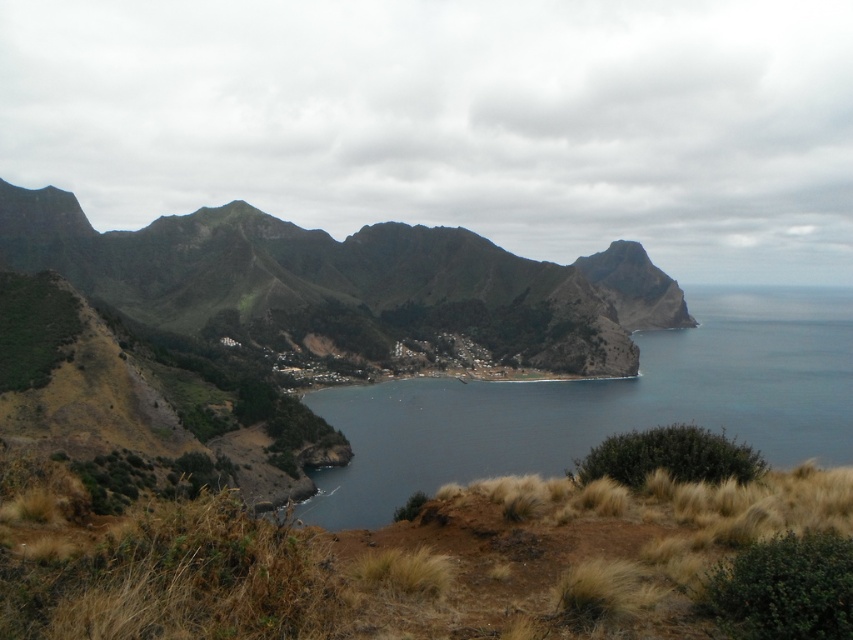
Question: Is green rough mountain at center behind dark blue water at center?

Choices:
 (A) no
 (B) yes

Answer: (B)

Question: Which of the following is the farthest from the observer?

Choices:
 (A) (537, 440)
 (B) (621, 337)

Answer: (B)

Question: Can you confirm if green rough mountain at center is thinner than dark blue water at center?

Choices:
 (A) no
 (B) yes

Answer: (A)

Question: Is green rough mountain at center in front of dark blue water at center?

Choices:
 (A) yes
 (B) no

Answer: (B)

Question: Among these points, which one is nearest to the camera?

Choices:
 (A) (759, 408)
 (B) (573, 268)

Answer: (A)

Question: Which of the following is the closest to the observer?

Choices:
 (A) green rough mountain at center
 (B) dark blue water at center

Answer: (B)